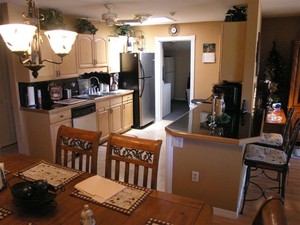
Identify the location of kitchen. (154, 129).